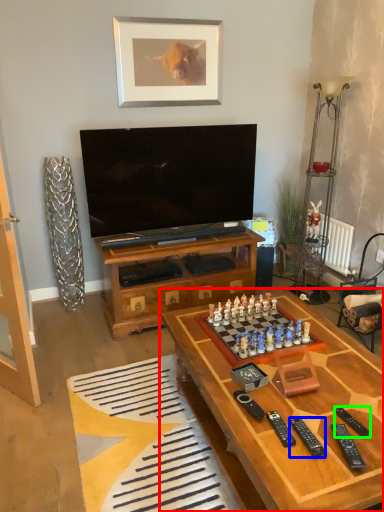
Question: Considering the real-world distances, which object is closest to table (highlighted by a red box)? remote (highlighted by a blue box) or remote (highlighted by a green box).

Choices:
 (A) remote
 (B) remote

Answer: (A)